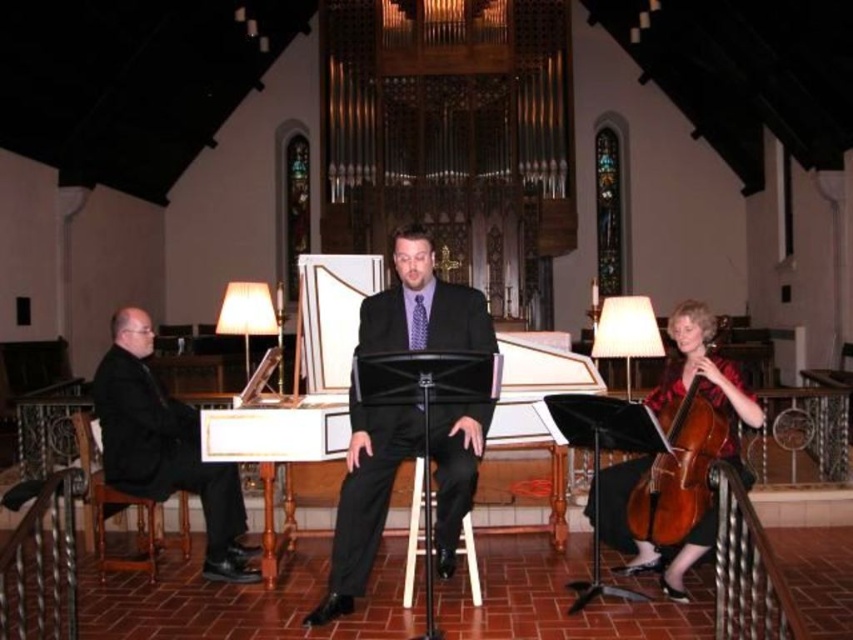
Does point (711, 488) come in front of point (109, 502)?

Yes, point (711, 488) is in front of point (109, 502).

Identify the location of brown wooden cello at lower right. This screenshot has height=640, width=853. (680, 468).

You are a GUI agent. You are given a task and a screenshot of the screen. Output one action in this format:
    pyautogui.click(x=<x>, y=<y>)
    Task: Click on the brown wooden cello at lower right
    
    Given the screenshot: What is the action you would take?
    pyautogui.click(x=680, y=468)

Who is higher up, black matte suit at left or brown wooden chair at left?

black matte suit at left is higher up.

Can you confirm if black matte suit at left is bigger than brown wooden chair at left?

Yes, black matte suit at left is bigger than brown wooden chair at left.

The image size is (853, 640). Describe the element at coordinates (164, 445) in the screenshot. I see `black matte suit at left` at that location.

Find the location of a particular element. The width and height of the screenshot is (853, 640). black matte suit at left is located at coordinates (164, 445).

Which is more to the left, brown wooden chair at left or wooden stool at center?

From the viewer's perspective, brown wooden chair at left appears more on the left side.

Who is more forward, (x=151, y=518) or (x=410, y=518)?

Point (x=151, y=518) is in front.

This screenshot has width=853, height=640. I want to click on brown wooden chair at left, so click(x=119, y=509).